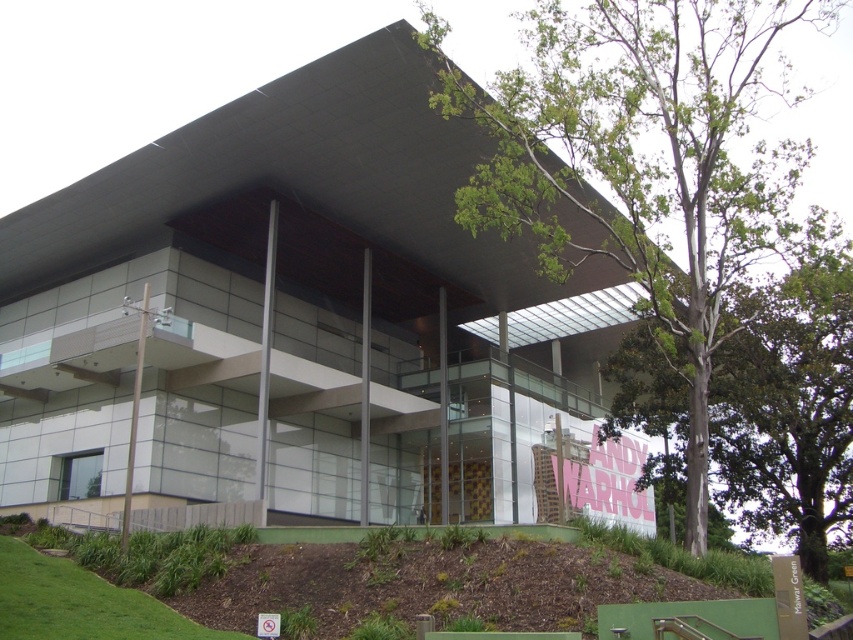
Is green leafy tree at upper right wider than green leafy tree at right?

Yes, green leafy tree at upper right is wider than green leafy tree at right.

Can you confirm if green leafy tree at upper right is thinner than green leafy tree at right?

No, green leafy tree at upper right is not thinner than green leafy tree at right.

Locate an element on the screen. The width and height of the screenshot is (853, 640). green leafy tree at upper right is located at coordinates (642, 160).

You are a GUI agent. You are given a task and a screenshot of the screen. Output one action in this format:
    pyautogui.click(x=<x>, y=<y>)
    Task: Click on the green leafy tree at upper right
    
    Given the screenshot: What is the action you would take?
    pyautogui.click(x=642, y=160)

Does green leafy tree at upper right appear under brown mulch at lower center?

Actually, green leafy tree at upper right is above brown mulch at lower center.

Is green leafy tree at upper right smaller than brown mulch at lower center?

Actually, green leafy tree at upper right might be larger than brown mulch at lower center.

What do you see at coordinates (642, 160) in the screenshot? I see `green leafy tree at upper right` at bounding box center [642, 160].

Identify the location of green leafy tree at upper right. This screenshot has height=640, width=853. (642, 160).

At what (x,y) coordinates should I click in order to perform the action: click on brown mulch at lower center. Please return your answer as a coordinate pair (x, y). The width and height of the screenshot is (853, 640). Looking at the image, I should click on (343, 589).

Is point (611, 572) less distant than point (717, 461)?

That is True.

This screenshot has height=640, width=853. What do you see at coordinates (343, 589) in the screenshot?
I see `brown mulch at lower center` at bounding box center [343, 589].

This screenshot has width=853, height=640. Identify the location of brown mulch at lower center. (343, 589).